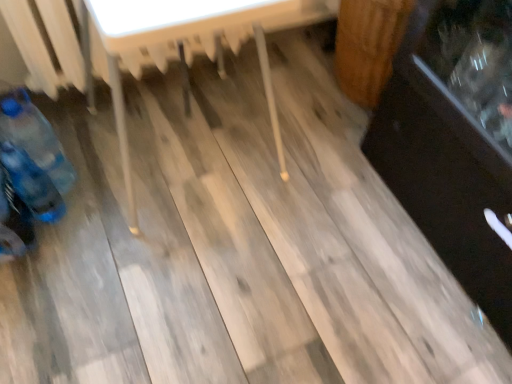
Where is `wooden table at center`? This screenshot has height=384, width=512. wooden table at center is located at coordinates (183, 46).

Could you tell me if wooden table at center is turned towards blue plastic bottle at lower left, positioned as the 2th bottle in top-to-bottom order?

No, wooden table at center is not facing towards blue plastic bottle at lower left, positioned as the 2th bottle in top-to-bottom order.

Visually, is wooden table at center positioned to the left or to the right of blue plastic bottle at lower left, the first bottle in the bottom-to-top sequence?

wooden table at center is positioned on blue plastic bottle at lower left, the first bottle in the bottom-to-top sequence,'s right side.

From the picture: Is wooden table at center far from blue plastic bottle at lower left, positioned as the 2th bottle in top-to-bottom order?

No, wooden table at center is not far away from blue plastic bottle at lower left, positioned as the 2th bottle in top-to-bottom order.

Can you confirm if wooden table at center is thinner than blue plastic bottle at lower left, positioned as the 2th bottle in top-to-bottom order?

Incorrect, the width of wooden table at center is not less than that of blue plastic bottle at lower left, positioned as the 2th bottle in top-to-bottom order.

Based on the photo, how different are the orientations of blue plastic bottle at left, marked as the 2th bottle in a bottom-to-top arrangement, and blue plastic bottle at lower left, the first bottle in the bottom-to-top sequence, in degrees?

blue plastic bottle at left, marked as the 2th bottle in a bottom-to-top arrangement, and blue plastic bottle at lower left, the first bottle in the bottom-to-top sequence, are facing 0.000358 degrees away from each other.

Is blue plastic bottle at left, arranged as the 1th bottle when viewed from the top, next to blue plastic bottle at lower left, positioned as the 2th bottle in top-to-bottom order?

No, blue plastic bottle at left, arranged as the 1th bottle when viewed from the top, is not touching blue plastic bottle at lower left, positioned as the 2th bottle in top-to-bottom order.

Does blue plastic bottle at left, marked as the 2th bottle in a bottom-to-top arrangement, appear on the left side of blue plastic bottle at lower left, positioned as the 2th bottle in top-to-bottom order?

Yes.

Can you confirm if blue plastic bottle at left, arranged as the 1th bottle when viewed from the top, is thinner than blue plastic bottle at lower left, positioned as the 2th bottle in top-to-bottom order?

No.

From the picture: Is blue plastic bottle at lower left, the first bottle in the bottom-to-top sequence, surrounding blue plastic bottle at left, marked as the 2th bottle in a bottom-to-top arrangement?

Definitely not — blue plastic bottle at left, marked as the 2th bottle in a bottom-to-top arrangement, is not inside blue plastic bottle at lower left, the first bottle in the bottom-to-top sequence.

From a real-world perspective, which is physically below, blue plastic bottle at lower left, the first bottle in the bottom-to-top sequence, or blue plastic bottle at left, arranged as the 1th bottle when viewed from the top?

In real-world perspective, blue plastic bottle at lower left, the first bottle in the bottom-to-top sequence, is lower.

Between blue plastic bottle at lower left, positioned as the 2th bottle in top-to-bottom order, and blue plastic bottle at left, arranged as the 1th bottle when viewed from the top, which one has less height?

blue plastic bottle at lower left, positioned as the 2th bottle in top-to-bottom order.

Between blue plastic bottle at lower left, positioned as the 2th bottle in top-to-bottom order, and blue plastic bottle at left, arranged as the 1th bottle when viewed from the top, which one has smaller width?

Thinner between the two is blue plastic bottle at lower left, positioned as the 2th bottle in top-to-bottom order.

From the image's perspective, is blue plastic bottle at lower left, the first bottle in the bottom-to-top sequence, above or below wooden table at center?

blue plastic bottle at lower left, the first bottle in the bottom-to-top sequence, is situated lower than wooden table at center in the image.

Is blue plastic bottle at lower left, the first bottle in the bottom-to-top sequence, not near wooden table at center?

Actually, blue plastic bottle at lower left, the first bottle in the bottom-to-top sequence, and wooden table at center are a little close together.

Which point is more distant from viewer, [31,204] or [120,45]?

The point [31,204] is farther.

From a real-world perspective, relative to wooden table at center, is blue plastic bottle at lower left, positioned as the 2th bottle in top-to-bottom order, vertically above or below?

Clearly, from a real-world perspective, blue plastic bottle at lower left, positioned as the 2th bottle in top-to-bottom order, is below wooden table at center.

Which is in front, blue plastic bottle at left, arranged as the 1th bottle when viewed from the top, or wooden table at center?

wooden table at center.

How many degrees apart are the facing directions of blue plastic bottle at left, arranged as the 1th bottle when viewed from the top, and wooden table at center?

0.000234 degrees separate the facing orientations of blue plastic bottle at left, arranged as the 1th bottle when viewed from the top, and wooden table at center.

Measure the distance between blue plastic bottle at left, arranged as the 1th bottle when viewed from the top, and wooden table at center.

The distance of blue plastic bottle at left, arranged as the 1th bottle when viewed from the top, from wooden table at center is 17.29 inches.

Between blue plastic bottle at left, marked as the 2th bottle in a bottom-to-top arrangement, and wooden table at center, which one has larger width?

Wider between the two is wooden table at center.

Consider the image. Are wooden table at center and blue plastic bottle at left, arranged as the 1th bottle when viewed from the top, making contact?

They are not placed beside each other.

Is wooden table at center smaller than blue plastic bottle at left, arranged as the 1th bottle when viewed from the top?

Actually, wooden table at center might be larger than blue plastic bottle at left, arranged as the 1th bottle when viewed from the top.

Starting from the wooden table at center, which bottle is the 1st one behind? Please provide its 2D coordinates.

[(32, 184)]

Where is `bottle on the right of blue plastic bottle at left, arranged as the 1th bottle when viewed from the top`? The width and height of the screenshot is (512, 384). bottle on the right of blue plastic bottle at left, arranged as the 1th bottle when viewed from the top is located at coordinates (32, 184).

When comparing their distances from blue plastic bottle at lower left, positioned as the 2th bottle in top-to-bottom order, does blue plastic bottle at left, marked as the 2th bottle in a bottom-to-top arrangement, or wooden table at center seem further?

wooden table at center.

Looking at this image, when comparing their distances from blue plastic bottle at left, marked as the 2th bottle in a bottom-to-top arrangement, does blue plastic bottle at lower left, positioned as the 2th bottle in top-to-bottom order, or wooden table at center seem further?

wooden table at center lies further to blue plastic bottle at left, marked as the 2th bottle in a bottom-to-top arrangement, than the other object.

Considering their positions, is wooden table at center positioned closer to blue plastic bottle at left, marked as the 2th bottle in a bottom-to-top arrangement, than blue plastic bottle at lower left, the first bottle in the bottom-to-top sequence?

blue plastic bottle at lower left, the first bottle in the bottom-to-top sequence, is positioned closer to the anchor blue plastic bottle at left, marked as the 2th bottle in a bottom-to-top arrangement.

In the scene shown: Estimate the real-world distances between objects in this image. Which object is further from blue plastic bottle at lower left, positioned as the 2th bottle in top-to-bottom order, wooden table at center or blue plastic bottle at left, arranged as the 1th bottle when viewed from the top?

Based on the image, wooden table at center appears to be further to blue plastic bottle at lower left, positioned as the 2th bottle in top-to-bottom order.

In the scene shown: Which object lies further to the anchor point wooden table at center, blue plastic bottle at left, marked as the 2th bottle in a bottom-to-top arrangement, or blue plastic bottle at lower left, the first bottle in the bottom-to-top sequence?

blue plastic bottle at lower left, the first bottle in the bottom-to-top sequence, is positioned further to the anchor wooden table at center.

Estimate the real-world distances between objects in this image. Which object is closer to wooden table at center, blue plastic bottle at lower left, the first bottle in the bottom-to-top sequence, or blue plastic bottle at left, arranged as the 1th bottle when viewed from the top?

The object closer to wooden table at center is blue plastic bottle at left, arranged as the 1th bottle when viewed from the top.

This screenshot has width=512, height=384. What are the coordinates of `bottle between blue plastic bottle at left, arranged as the 1th bottle when viewed from the top, and wooden table at center` in the screenshot? It's located at (32, 184).